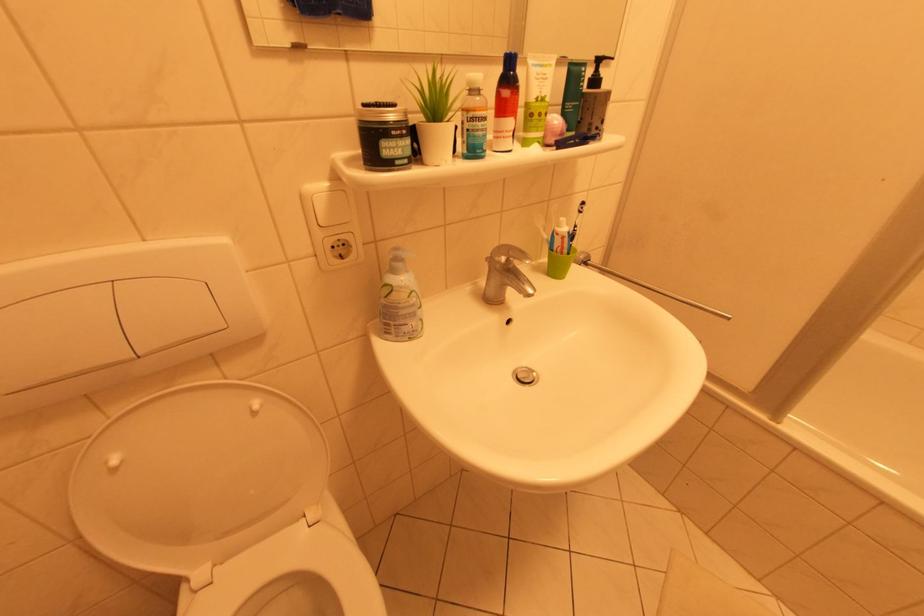
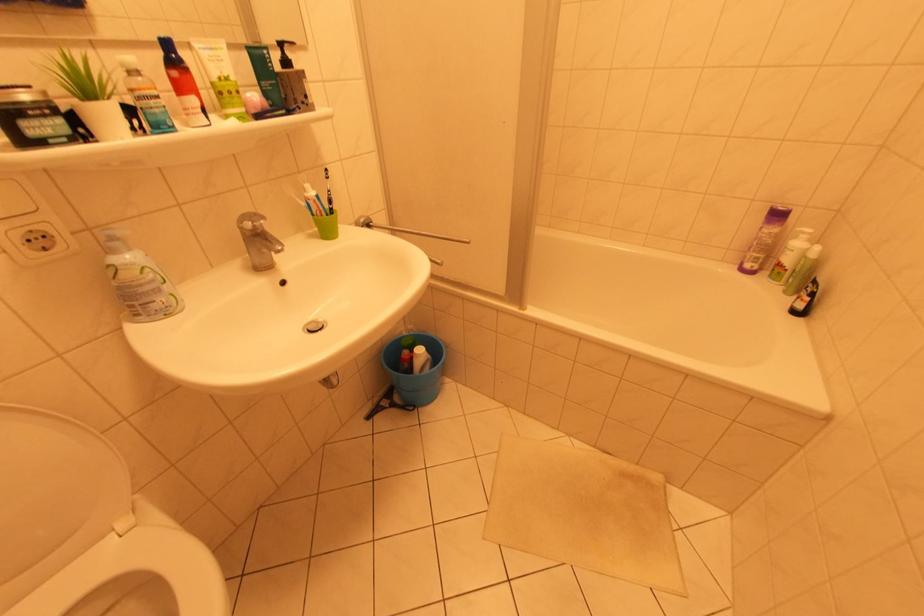
Question: Based on the continuous images, in which direction is the camera rotating? Reply with the corresponding letter.

Choices:
 (A) Left
 (B) Right
 (C) Up
 (D) Down

Answer: (B)